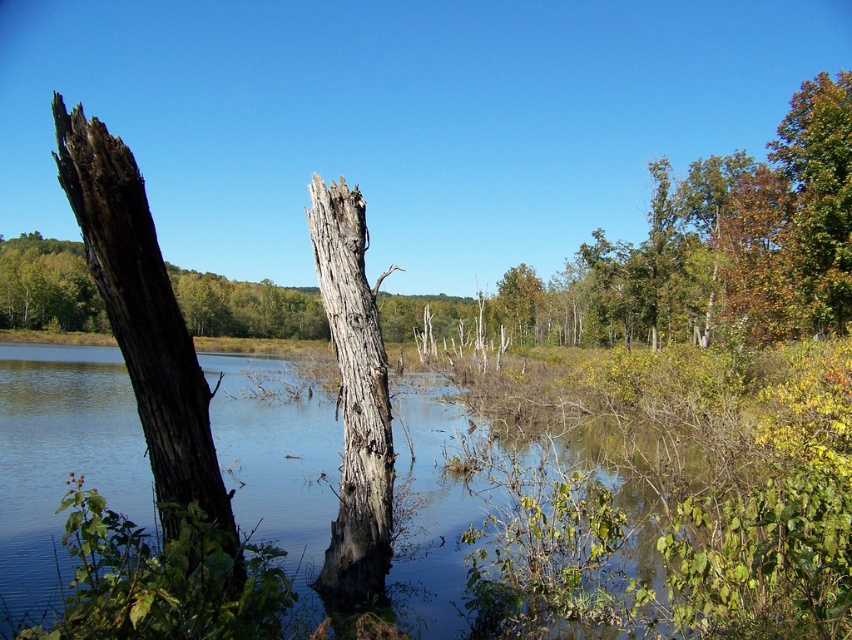
You are standing at the edge of the water and want to reach the clear water at center marked by point (566,541). What direction should you walk to get there?

You should walk towards the center of the water to reach the clear water at center marked by point (566,541).

You are a park ranger planning to install a safety barrier between the clear water at center and the gray rough bark tree trunk at center. The barrier needs to be at least 5 meters long to be effective. Based on the scene, will the barrier be long enough?

The distance between the clear water at center and the gray rough bark tree trunk at center is 4.85 meters. Since the required barrier length is 5 meters, the barrier will be slightly too short to cover the entire distance between them.

You are standing at the edge of the water in the serene landscape scene. You see two points marked in the image. Which point is closer to you, point (608, 570) or point (357, 268)?

Point (608, 570) is closer to the viewer than point (357, 268).